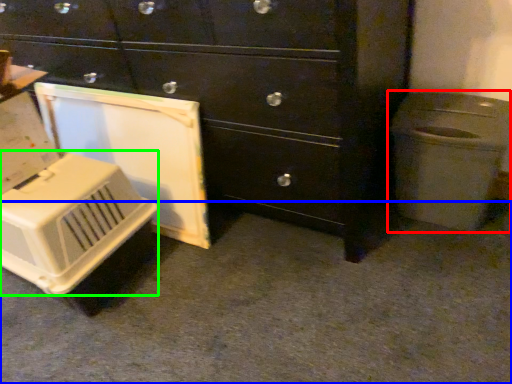
Question: Estimate the real-world distances between objects in this image. Which object is closer to waste container (highlighted by a red box), concrete (highlighted by a blue box) or appliance (highlighted by a green box)?

Choices:
 (A) concrete
 (B) appliance

Answer: (A)